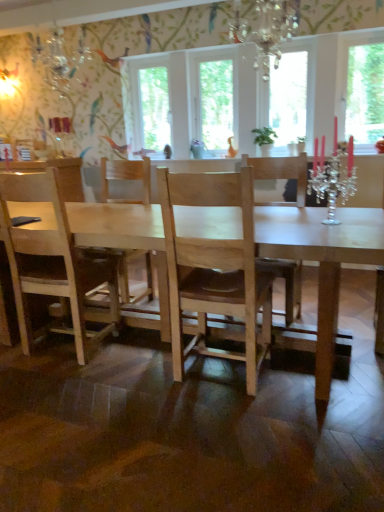
Find the location of a particular element. transparent glass window at center, the third window screen in the right-to-left sequence is located at coordinates (216, 103).

Image resolution: width=384 pixels, height=512 pixels. Find the location of `clear glass window at center, acting as the 1th window screen starting from the left`. clear glass window at center, acting as the 1th window screen starting from the left is located at coordinates (154, 108).

Measure the distance between clear glass window at center, acting as the 1th window screen starting from the left, and camera.

They are 4.14 meters apart.

At what (x,y) coordinates should I click in order to perform the action: click on green matte plant at upper center. Please return your answer as a coordinate pair (x, y). Looking at the image, I should click on (264, 136).

The image size is (384, 512). In order to click on light wood table at center in this screenshot , I will do `click(322, 259)`.

Which is behind, transparent glass window at upper right, positioned as the first window screen in right-to-left order, or light wood table at center?

transparent glass window at upper right, positioned as the first window screen in right-to-left order, is further away from the camera.

From the image's perspective, is transparent glass window at upper right, arranged as the 4th window screen when viewed from the left, above light wood table at center?

Correct, transparent glass window at upper right, arranged as the 4th window screen when viewed from the left, appears higher than light wood table at center in the image.

Considering the positions of point (381, 132) and point (261, 234), is point (381, 132) closer or farther from the camera than point (261, 234)?

Point (381, 132) is farther from the camera than point (261, 234).

From a real-world perspective, is transparent glass window at upper right, positioned as the first window screen in right-to-left order, under light wood table at center?

Incorrect, from a real-world perspective, transparent glass window at upper right, positioned as the first window screen in right-to-left order, is higher than light wood table at center.

Between point (261, 131) and point (363, 115), which one is positioned behind?

Positioned behind is point (261, 131).

From the image's perspective, who appears lower, green matte plant at upper center or transparent glass window at upper right, positioned as the first window screen in right-to-left order?

green matte plant at upper center, from the image's perspective.

Considering the relative sizes of green matte plant at upper center and transparent glass window at upper right, arranged as the 4th window screen when viewed from the left, in the image provided, is green matte plant at upper center wider than transparent glass window at upper right, arranged as the 4th window screen when viewed from the left,?

Indeed, green matte plant at upper center has a greater width compared to transparent glass window at upper right, arranged as the 4th window screen when viewed from the left.

From a real-world perspective, between green matte plant at upper center and transparent glass window at upper right, arranged as the 4th window screen when viewed from the left, who is vertically lower?

green matte plant at upper center, from a real-world perspective.

From the picture: In the image, is green matte plant at upper center positioned in front of or behind crystal chandelier at upper center?

green matte plant at upper center is positioned farther from the viewer than crystal chandelier at upper center.

Does green matte plant at upper center have a greater height compared to crystal chandelier at upper center?

No, green matte plant at upper center is not taller than crystal chandelier at upper center.

Is green matte plant at upper center inside or outside of crystal chandelier at upper center?

green matte plant at upper center is not enclosed by crystal chandelier at upper center.

How far apart are green matte plant at upper center and crystal chandelier at upper center?

green matte plant at upper center and crystal chandelier at upper center are 29.66 inches apart.

From the image's perspective, does transparent glass window at center, positioned as the second window screen in right-to-left order, appear lower than light wood chair at center?

Incorrect, from the image's perspective, transparent glass window at center, positioned as the second window screen in right-to-left order, is higher than light wood chair at center.

In the scene shown: Is transparent glass window at center, positioned as the third window screen in left-to-right order, bigger than light wood chair at center?

No.

Can you tell me how much transparent glass window at center, positioned as the second window screen in right-to-left order, and light wood chair at center differ in facing direction?

transparent glass window at center, positioned as the second window screen in right-to-left order, and light wood chair at center are facing 3.68 degrees away from each other.

Is transparent glass window at center, positioned as the second window screen in right-to-left order, oriented towards light wood chair at center?

No, transparent glass window at center, positioned as the second window screen in right-to-left order, is not turned towards light wood chair at center.

What are the coordinates of `the 1st window screen to the left when counting from the green matte plant at upper center` in the screenshot? It's located at (216, 103).

From a real-world perspective, which object rests below the other?

In real-world perspective, green matte plant at upper center is lower.

From the picture: Considering the sizes of objects transparent glass window at center, marked as the 2th window screen in a left-to-right arrangement, and green matte plant at upper center in the image provided, who is thinner, transparent glass window at center, marked as the 2th window screen in a left-to-right arrangement, or green matte plant at upper center?

With smaller width is transparent glass window at center, marked as the 2th window screen in a left-to-right arrangement.

From the image's perspective, is transparent glass window at center, the third window screen in the right-to-left sequence, positioned above or below green matte plant at upper center?

transparent glass window at center, the third window screen in the right-to-left sequence, is above green matte plant at upper center.

Are light wood chair at center and transparent glass window at center, positioned as the third window screen in left-to-right order, beside each other?

No, light wood chair at center is not in contact with transparent glass window at center, positioned as the third window screen in left-to-right order.

Does light wood chair at center turn towards transparent glass window at center, positioned as the third window screen in left-to-right order?

No, light wood chair at center is not aimed at transparent glass window at center, positioned as the third window screen in left-to-right order.

Considering the relative sizes of light wood chair at center and transparent glass window at center, positioned as the third window screen in left-to-right order, in the image provided, is light wood chair at center taller than transparent glass window at center, positioned as the third window screen in left-to-right order,?

Yes.

Considering the relative positions of light wood chair at center and transparent glass window at center, positioned as the third window screen in left-to-right order, in the image provided, is light wood chair at center to the right of transparent glass window at center, positioned as the third window screen in left-to-right order, from the viewer's perspective?

Incorrect, light wood chair at center is not on the right side of transparent glass window at center, positioned as the third window screen in left-to-right order.

Considering the positions of objects light wood table at center and transparent glass window at upper right, positioned as the first window screen in right-to-left order, in the image provided, who is more to the right, light wood table at center or transparent glass window at upper right, positioned as the first window screen in right-to-left order,?

From the viewer's perspective, transparent glass window at upper right, positioned as the first window screen in right-to-left order, appears more on the right side.

Can you confirm if light wood table at center is smaller than transparent glass window at upper right, positioned as the first window screen in right-to-left order?

No.

At what (x,y) coordinates should I click in order to perform the action: click on the 4th window screen positioned above the light wood table at center (from a real-world perspective). Please return your answer as a coordinate pair (x, y). Looking at the image, I should click on (365, 92).

Does light wood table at center have a greater width compared to transparent glass window at upper right, arranged as the 4th window screen when viewed from the left?

Yes.

You are a GUI agent. You are given a task and a screenshot of the screen. Output one action in this format:
    pyautogui.click(x=<x>, y=<y>)
    Task: Click on the 1st window screen positioned above the light wood table at center (from the image's perspective)
    The width and height of the screenshot is (384, 512).
    Given the screenshot: What is the action you would take?
    pyautogui.click(x=365, y=92)

You are a GUI agent. You are given a task and a screenshot of the screen. Output one action in this format:
    pyautogui.click(x=<x>, y=<y>)
    Task: Click on the 4th window screen located above the green matte plant at upper center (from a real-world perspective)
    Image resolution: width=384 pixels, height=512 pixels.
    Given the screenshot: What is the action you would take?
    pyautogui.click(x=365, y=92)

Considering their positions, is light wood table at center positioned closer to transparent glass window at upper right, positioned as the first window screen in right-to-left order, than green matte plant at upper center?

Based on the image, green matte plant at upper center appears to be nearer to transparent glass window at upper right, positioned as the first window screen in right-to-left order.

Which object lies nearer to the anchor point transparent glass window at center, positioned as the third window screen in left-to-right order, clear glass window at center, which ranks as the 4th window screen in right-to-left order, or green matte plant at upper center?

green matte plant at upper center lies closer to transparent glass window at center, positioned as the third window screen in left-to-right order, than the other object.

Based on their spatial positions, is light wood table at center or transparent glass window at center, positioned as the second window screen in right-to-left order, further from crystal chandelier at upper center?

light wood table at center.

Considering their positions, is light wood table at center positioned further to green matte plant at upper center than transparent glass window at upper right, arranged as the 4th window screen when viewed from the left?

light wood table at center is further to green matte plant at upper center.

Which object lies further to the anchor point clear glass window at center, which ranks as the 4th window screen in right-to-left order, transparent glass window at center, positioned as the second window screen in right-to-left order, or crystal chandelier at upper center?

transparent glass window at center, positioned as the second window screen in right-to-left order, is positioned further to the anchor clear glass window at center, which ranks as the 4th window screen in right-to-left order.

Estimate the real-world distances between objects in this image. Which object is further from light wood chair at center, clear glass window at center, which ranks as the 4th window screen in right-to-left order, or crystal chandelier at upper center?

crystal chandelier at upper center is further to light wood chair at center.

Considering their positions, is transparent glass window at center, the third window screen in the right-to-left sequence, positioned closer to crystal chandelier at upper center than transparent glass window at upper right, positioned as the first window screen in right-to-left order?

transparent glass window at center, the third window screen in the right-to-left sequence, lies closer to crystal chandelier at upper center than the other object.

When comparing their distances from transparent glass window at center, positioned as the third window screen in left-to-right order, does clear glass window at center, acting as the 1th window screen starting from the left, or light wood table at center seem further?

light wood table at center.

What are the coordinates of `chair between crystal chandelier at upper center and light wood table at center in the up-down direction` in the screenshot? It's located at (126, 179).

The width and height of the screenshot is (384, 512). Identify the location of window screen between clear glass window at center, which ranks as the 4th window screen in right-to-left order, and green matte plant at upper center. (216, 103).

Locate an element on the screen. light fixture located between light wood table at center and transparent glass window at center, the third window screen in the right-to-left sequence, in the depth direction is located at coordinates (266, 29).

The width and height of the screenshot is (384, 512). Identify the location of plant between light wood chair at center and transparent glass window at center, positioned as the third window screen in left-to-right order, in the horizontal direction. (264, 136).